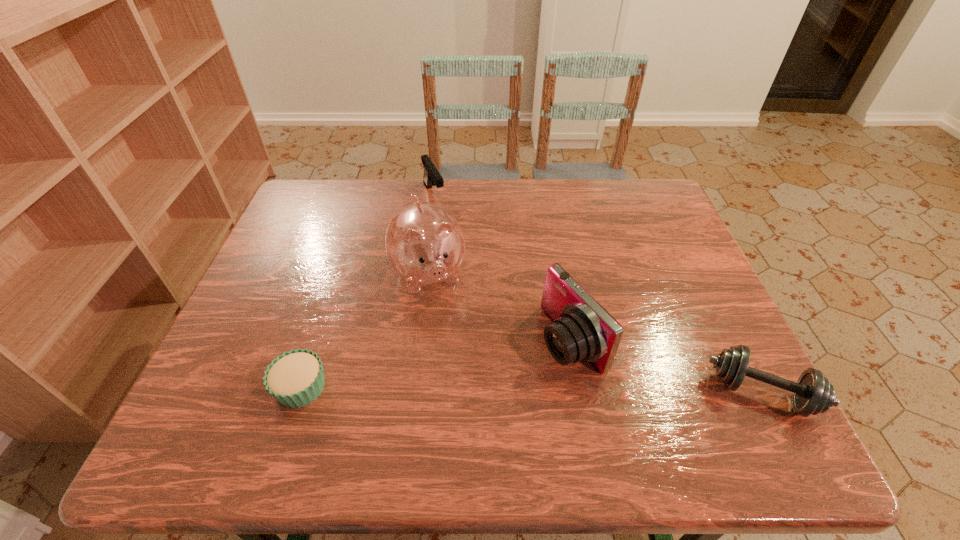
You are a GUI agent. You are given a task and a screenshot of the screen. Output one action in this format:
    pyautogui.click(x=<x>, y=<y>)
    Task: Click on the vacant region at the far left corner of the desktop
    This screenshot has height=540, width=960.
    Given the screenshot: What is the action you would take?
    pyautogui.click(x=319, y=197)

This screenshot has height=540, width=960. In the image, there is a desktop. What are the coordinates of `vacant space at the far right corner` in the screenshot? It's located at (640, 205).

The width and height of the screenshot is (960, 540). I want to click on free space that is in between the dumbbell and the farthest object, so click(x=597, y=293).

This screenshot has width=960, height=540. I want to click on free point between the dumbbell and the farthest object, so click(x=597, y=293).

Identify the location of free space that is in between the fourth shortest object and the pistol. (502, 267).

Identify the location of empty space between the shortest object and the camera. 436,363.

Find the location of a particular element. This screenshot has height=540, width=960. free area in between the fourth object from left to right and the pistol is located at coordinates (502, 267).

The height and width of the screenshot is (540, 960). I want to click on vacant space that is in between the tallest object and the camera, so click(500, 307).

At what (x,y) coordinates should I click in order to perform the action: click on free spot between the pistol and the second object from right to left. Please return your answer as a coordinate pair (x, y). The height and width of the screenshot is (540, 960). Looking at the image, I should click on (502, 267).

I want to click on free spot between the leftmost object and the piggy bank, so [365, 330].